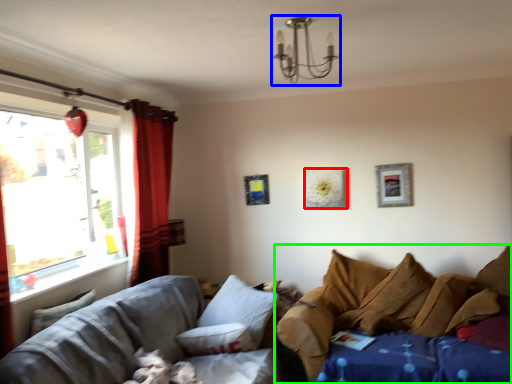
Question: Which is nearer to the picture frame (highlighted by a red box)? light fixture (highlighted by a blue box) or studio couch (highlighted by a green box).

Choices:
 (A) light fixture
 (B) studio couch

Answer: (B)